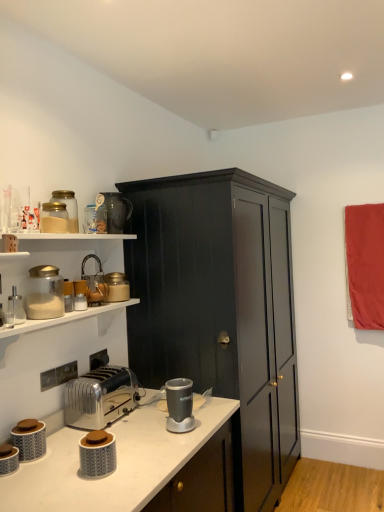
Question: Can you confirm if matte glass jar at upper left, the 1th appliance positioned from the top, is bigger than metallic faucet at upper left, the third appliance viewed from the top?

Choices:
 (A) no
 (B) yes

Answer: (B)

Question: Can you confirm if matte glass jar at upper left, the 11th appliance ordered from the bottom, is smaller than metallic faucet at upper left, positioned as the ninth appliance in bottom-to-top order?

Choices:
 (A) no
 (B) yes

Answer: (A)

Question: Does matte glass jar at upper left, the 1th appliance positioned from the top, turn towards metallic faucet at upper left, the third appliance viewed from the top?

Choices:
 (A) yes
 (B) no

Answer: (B)

Question: From a real-world perspective, is matte glass jar at upper left, the 11th appliance ordered from the bottom, beneath metallic faucet at upper left, positioned as the ninth appliance in bottom-to-top order?

Choices:
 (A) no
 (B) yes

Answer: (A)

Question: From the image's perspective, does matte glass jar at upper left, the 1th appliance positioned from the top, appear higher than metallic faucet at upper left, positioned as the ninth appliance in bottom-to-top order?

Choices:
 (A) no
 (B) yes

Answer: (B)

Question: From a real-world perspective, is matte glass jar at upper left, the 1th appliance positioned from the top, physically located above or below matte glass jar at upper left, positioned as the 5th appliance in top-to-bottom order?

Choices:
 (A) below
 (B) above

Answer: (B)

Question: From the image's perspective, is matte glass jar at upper left, the 11th appliance ordered from the bottom, located above or below matte glass jar at upper left, placed as the seventh appliance when sorted from bottom to top?

Choices:
 (A) above
 (B) below

Answer: (A)

Question: From their relative heights in the image, would you say matte glass jar at upper left, the 11th appliance ordered from the bottom, is taller or shorter than matte glass jar at upper left, placed as the seventh appliance when sorted from bottom to top?

Choices:
 (A) tall
 (B) short

Answer: (A)

Question: Is point (127, 205) closer or farther from the camera than point (119, 297)?

Choices:
 (A) closer
 (B) farther

Answer: (B)

Question: In the image, is matte glass jar at upper left, positioned as the 5th appliance in top-to-bottom order, positioned in front of or behind dark wood cabinet at center?

Choices:
 (A) front
 (B) behind

Answer: (B)

Question: Which is correct: matte glass jar at upper left, positioned as the 5th appliance in top-to-bottom order, is inside dark wood cabinet at center, or outside of it?

Choices:
 (A) inside
 (B) outside

Answer: (B)

Question: Is matte glass jar at upper left, placed as the seventh appliance when sorted from bottom to top, taller or shorter than dark wood cabinet at center?

Choices:
 (A) short
 (B) tall

Answer: (A)

Question: Is matte glass jar at upper left, positioned as the 5th appliance in top-to-bottom order, wider or thinner than dark wood cabinet at center?

Choices:
 (A) wide
 (B) thin

Answer: (B)

Question: From the image's perspective, is matte gray canister at lower left, which ranks as the 1th appliance in bottom-to-top order, above or below matte glass jar at upper left, the 11th appliance ordered from the bottom?

Choices:
 (A) above
 (B) below

Answer: (B)

Question: From a real-world perspective, is matte gray canister at lower left, which ranks as the 1th appliance in bottom-to-top order, above or below matte glass jar at upper left, the 11th appliance ordered from the bottom?

Choices:
 (A) below
 (B) above

Answer: (A)